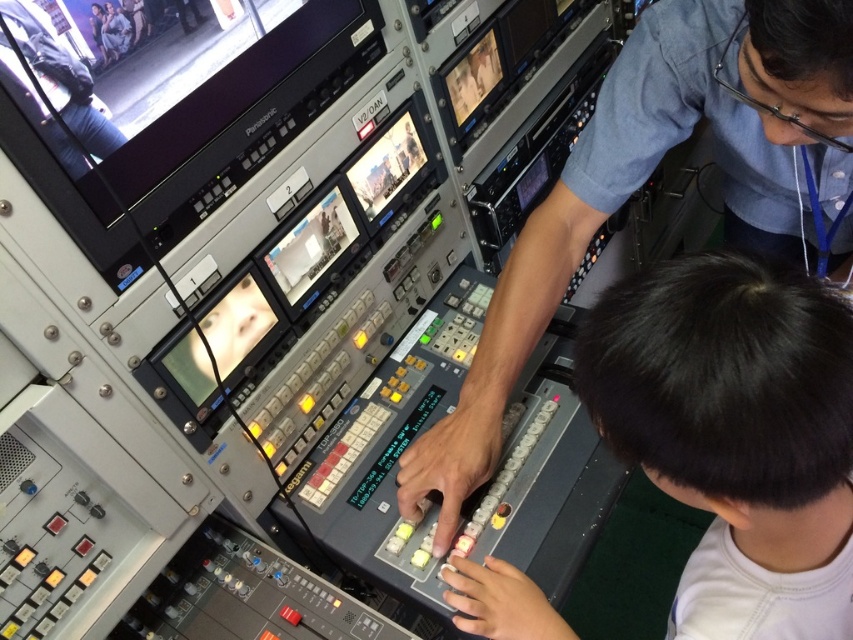
The height and width of the screenshot is (640, 853). What are the coordinates of `metallic gray control panel at center` in the screenshot? It's located at (643, 180).

Is metallic gray control panel at center to the right of matte black pants at upper left from the viewer's perspective?

Indeed, metallic gray control panel at center is positioned on the right side of matte black pants at upper left.

Where is `metallic gray control panel at center`? The width and height of the screenshot is (853, 640). metallic gray control panel at center is located at coordinates (643, 180).

Is dark hair at center to the left of matte black pants at upper left from the viewer's perspective?

Incorrect, dark hair at center is not on the left side of matte black pants at upper left.

Who is lower down, dark hair at center or matte black pants at upper left?

dark hair at center is lower down.

Locate an element on the screen. dark hair at center is located at coordinates (733, 426).

In the scene shown: Does dark hair at center appear on the right side of metallic gray control panel at center?

Incorrect, dark hair at center is not on the right side of metallic gray control panel at center.

Is the position of dark hair at center less distant than that of metallic gray control panel at center?

That is True.

What do you see at coordinates (733, 426) in the screenshot?
I see `dark hair at center` at bounding box center [733, 426].

Where is `dark hair at center`? The height and width of the screenshot is (640, 853). dark hair at center is located at coordinates (733, 426).